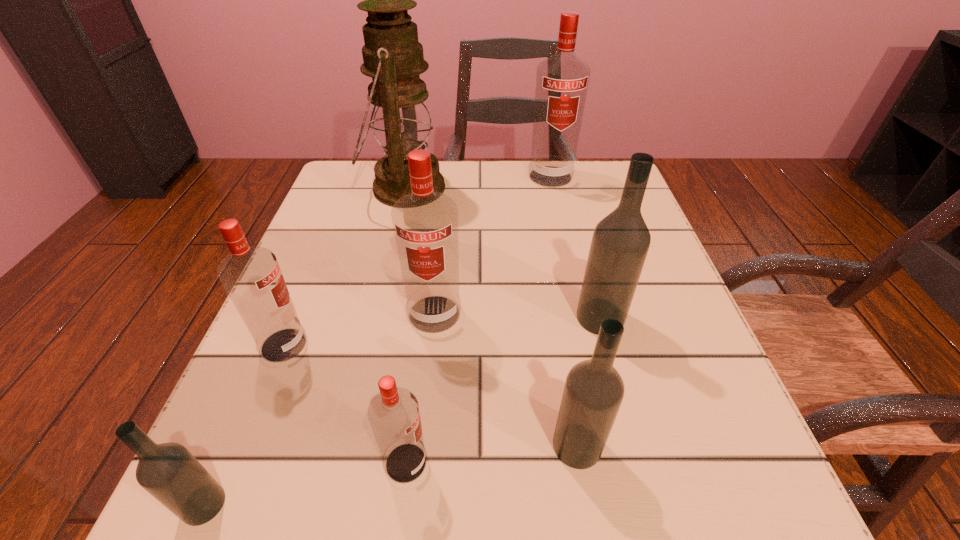
Locate an element on the screen. the nearest black vodka is located at coordinates (168, 471).

Identify the location of the smallest black vodka. click(x=168, y=471).

Where is `blank area located on the front of the green oil lamp`? The width and height of the screenshot is (960, 540). blank area located on the front of the green oil lamp is located at coordinates (371, 339).

This screenshot has height=540, width=960. Find the location of `blank space located 0.070m on the front label of the rightmost red vodka`. blank space located 0.070m on the front label of the rightmost red vodka is located at coordinates (557, 205).

Locate an element on the screen. This screenshot has width=960, height=540. blank space located on the back of the biggest black vodka is located at coordinates (570, 205).

Image resolution: width=960 pixels, height=540 pixels. Find the location of `free region located 0.140m on the front label of the third smallest red vodka`. free region located 0.140m on the front label of the third smallest red vodka is located at coordinates (424, 412).

The width and height of the screenshot is (960, 540). I want to click on free space located 0.210m on the front label of the second smallest red vodka, so click(x=438, y=345).

Where is `free space located on the back of the second nearest black vodka`? free space located on the back of the second nearest black vodka is located at coordinates (547, 265).

At what (x,y) coordinates should I click in order to perform the action: click on vacant space located 0.200m on the front label of the smallest red vodka. Please return your answer as a coordinate pair (x, y). Looking at the image, I should click on (583, 463).

Identify the location of vacant space positioned 0.100m on the back of the smallest black vodka. (244, 411).